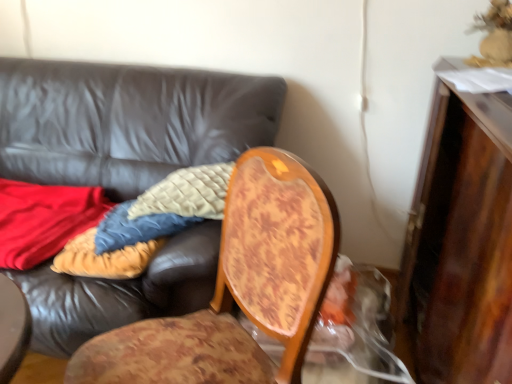
Question: Do you think leather couch at center is within wooden chair at center, or outside of it?

Choices:
 (A) inside
 (B) outside

Answer: (B)

Question: In terms of width, does leather couch at center look wider or thinner when compared to wooden chair at center?

Choices:
 (A) wide
 (B) thin

Answer: (A)

Question: Which object is the closest to the leather couch at center?

Choices:
 (A) wooden dresser at right
 (B) wooden chair at center

Answer: (B)

Question: Which of these objects is positioned closest to the wooden dresser at right?

Choices:
 (A) leather couch at center
 (B) wooden chair at center

Answer: (B)